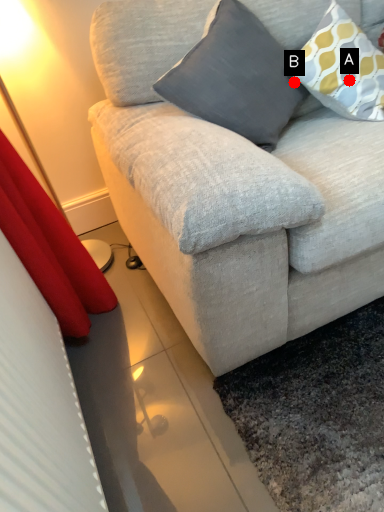
Question: Two points are circled on the image, labeled by A and B beside each circle. Which point appears closest to the camera in this image?

Choices:
 (A) A is closer
 (B) B is closer

Answer: (A)